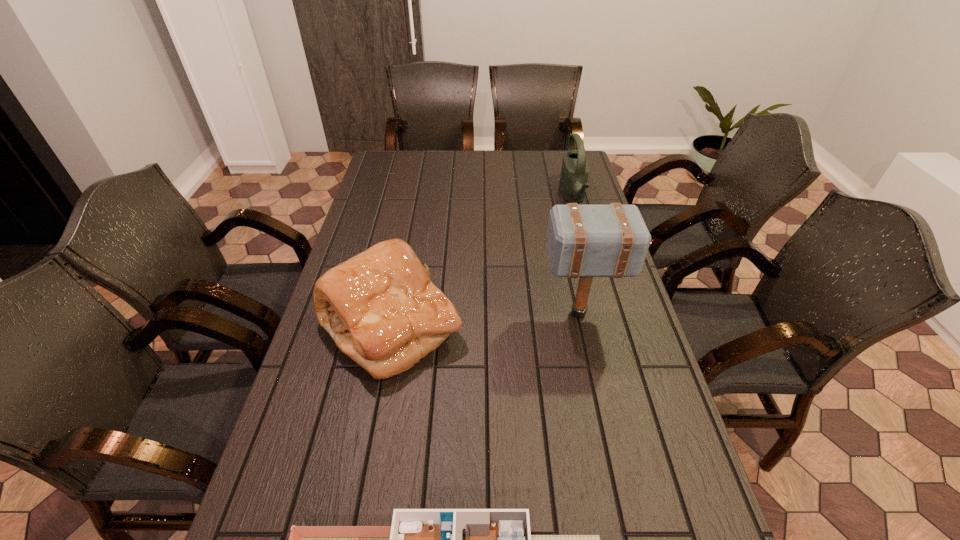
Where is `mallet`? The width and height of the screenshot is (960, 540). mallet is located at coordinates (586, 241).

This screenshot has height=540, width=960. I want to click on the farthest object, so click(x=574, y=174).

This screenshot has height=540, width=960. I want to click on bread, so click(380, 307).

Identify the location of vacant point located on the striking surface of the mallet. This screenshot has width=960, height=540. (506, 313).

At what (x,y) coordinates should I click in order to perform the action: click on free space located on the striking surface of the mallet. Please return your answer as a coordinate pair (x, y). This screenshot has height=540, width=960. Looking at the image, I should click on (510, 313).

Locate an element on the screen. The height and width of the screenshot is (540, 960). free space located 0.100m on the striking surface of the mallet is located at coordinates (506, 313).

At what (x,y) coordinates should I click in order to perform the action: click on vacant space located on the spout of the farthest object. Please return your answer as a coordinate pair (x, y). Looking at the image, I should click on (520, 197).

Identify the location of vacant space located 0.130m on the spout of the farthest object. This screenshot has width=960, height=540. (528, 197).

Where is `free spot located 0.090m on the spout of the farthest object`? The width and height of the screenshot is (960, 540). free spot located 0.090m on the spout of the farthest object is located at coordinates (539, 197).

This screenshot has width=960, height=540. I want to click on vacant area situated on the filling side of the bread, so (x=556, y=325).